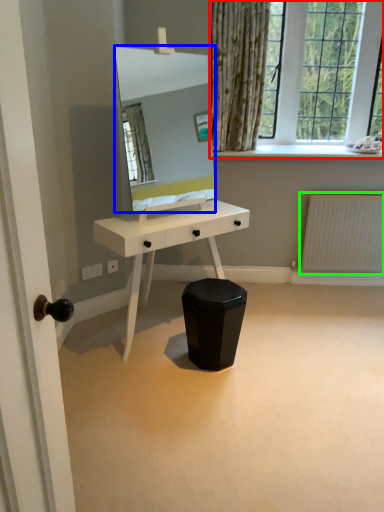
Question: Which object is the farthest from window (highlighted by a red box)? Choose among these: mirror (highlighted by a blue box) or radiator (highlighted by a green box).

Choices:
 (A) mirror
 (B) radiator

Answer: (A)